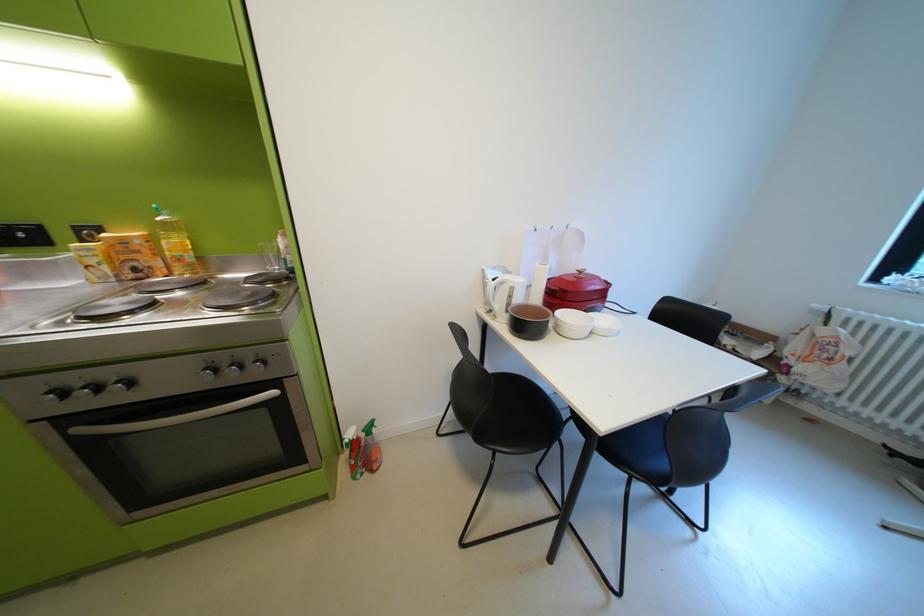
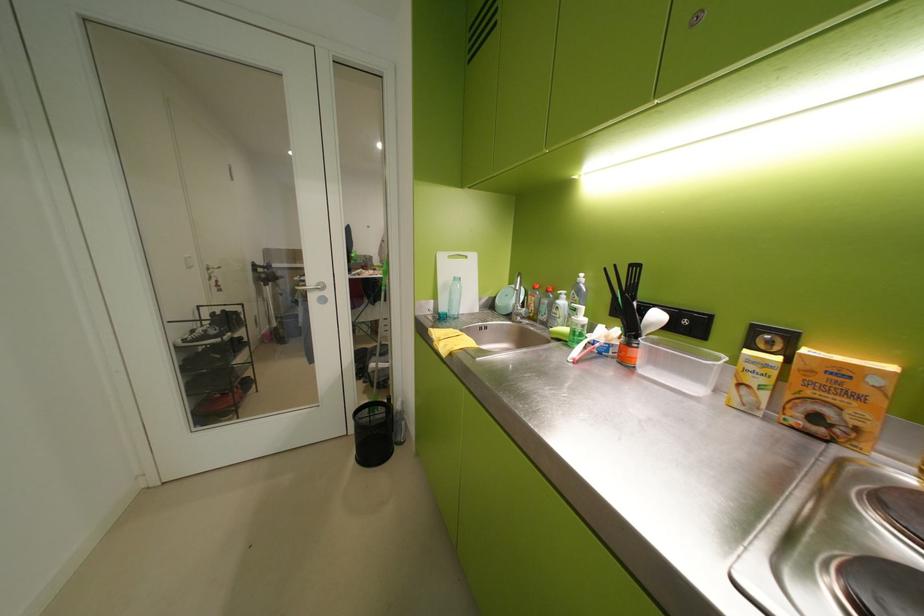
In the second image, find the point that corresponds to (88,230) in the first image.

(767, 331)